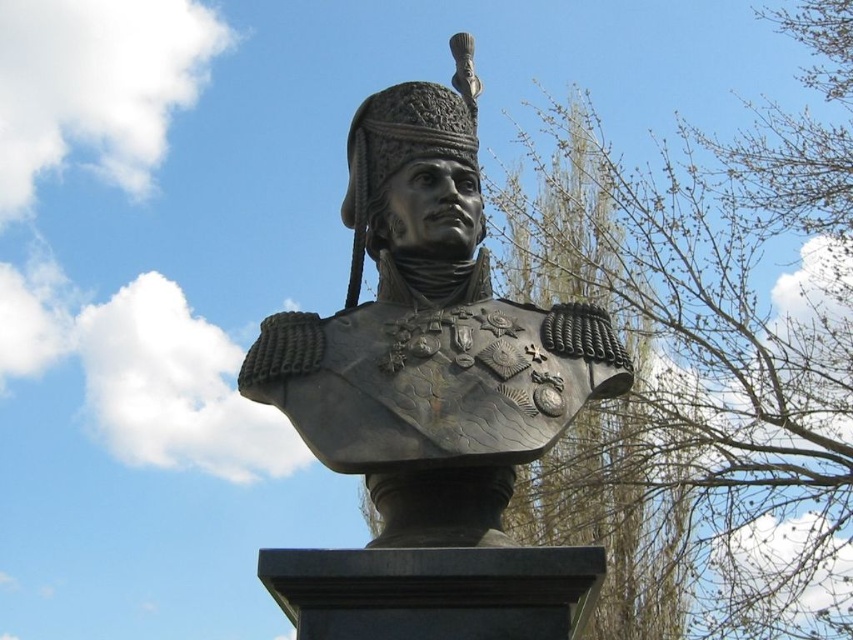
Question: Is bare branches at upper center to the left of shiny bronze bust at center from the viewer's perspective?

Choices:
 (A) yes
 (B) no

Answer: (B)

Question: Can you confirm if bare branches at upper center is bigger than shiny bronze bust at center?

Choices:
 (A) no
 (B) yes

Answer: (B)

Question: Which object is the farthest from the shiny bronze helmet at center?

Choices:
 (A) shiny bronze bust at center
 (B) bare branches at upper center

Answer: (B)

Question: Among these points, which one is farthest from the camera?

Choices:
 (A) (325, 330)
 (B) (820, 140)
 (C) (405, 96)

Answer: (B)

Question: Estimate the real-world distances between objects in this image. Which object is closer to the shiny bronze bust at center?

Choices:
 (A) shiny bronze helmet at center
 (B) bare branches at upper center

Answer: (A)

Question: Is bare branches at upper center smaller than shiny bronze helmet at center?

Choices:
 (A) no
 (B) yes

Answer: (A)